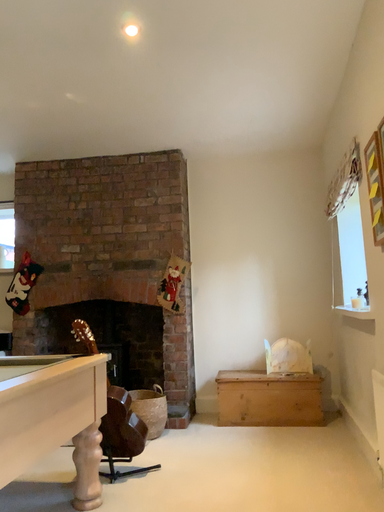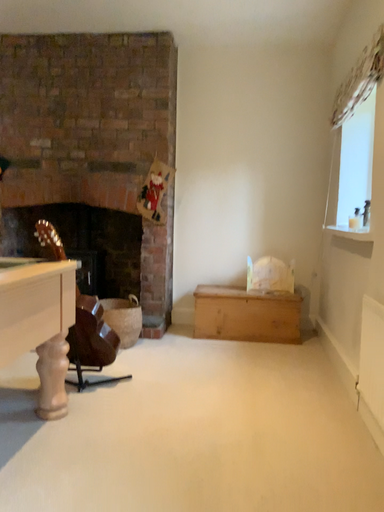
Question: How did the camera likely rotate when shooting the video?

Choices:
 (A) rotated downward
 (B) rotated upward

Answer: (A)